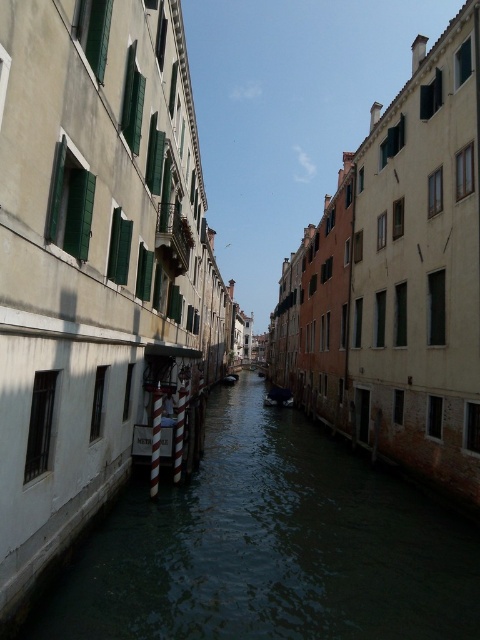
Question: Observing the image, what is the correct spatial positioning of greenish water at center in reference to shiny blue boat at center?

Choices:
 (A) below
 (B) above

Answer: (B)

Question: Can you confirm if greenish water at center is wider than shiny blue boat at center?

Choices:
 (A) no
 (B) yes

Answer: (B)

Question: Which point is farther to the camera?

Choices:
 (A) greenish water at center
 (B) shiny blue boat at center

Answer: (B)

Question: Is greenish water at center closer to camera compared to shiny blue boat at center?

Choices:
 (A) no
 (B) yes

Answer: (B)

Question: Which of the following is the closest to the observer?

Choices:
 (A) (267, 403)
 (B) (440, 508)

Answer: (B)